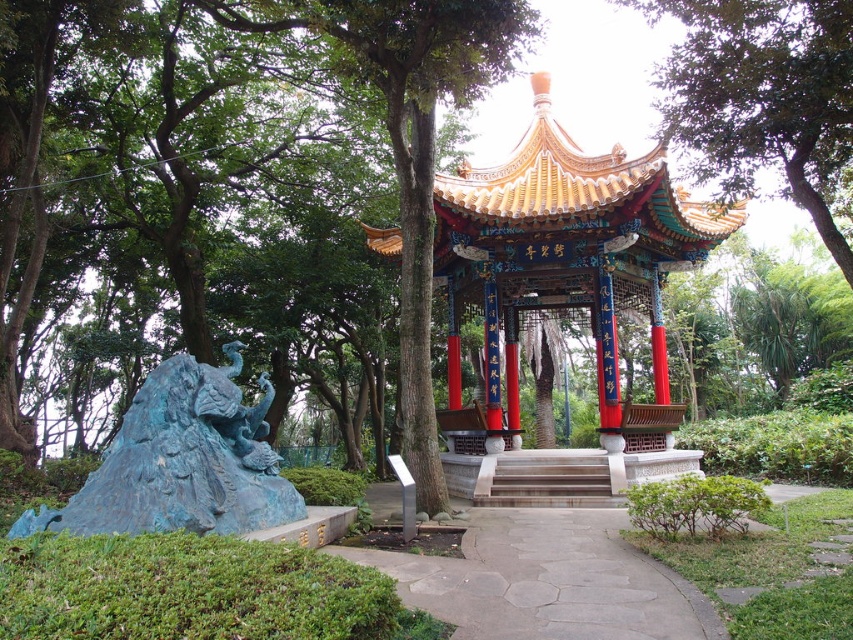
Question: Is gray stone path at center wider than smooth stone stairs at center?

Choices:
 (A) yes
 (B) no

Answer: (A)

Question: Which of the following is the farthest from the observer?

Choices:
 (A) gray stone path at center
 (B) blue patina dragon at lower left
 (C) golden glazed pagoda at center
 (D) smooth stone stairs at center

Answer: (C)

Question: Among these points, which one is farthest from the camera?

Choices:
 (A) (614, 384)
 (B) (490, 556)
 (C) (711, 131)

Answer: (A)

Question: Does golden glazed pagoda at center come behind smooth stone stairs at center?

Choices:
 (A) no
 (B) yes

Answer: (B)

Question: Observing the image, what is the correct spatial positioning of golden glazed pagoda at center in reference to gray stone path at center?

Choices:
 (A) below
 (B) above

Answer: (B)

Question: Among these objects, which one is nearest to the camera?

Choices:
 (A) smooth stone stairs at center
 (B) golden glazed pagoda at center
 (C) blue patina dragon at lower left

Answer: (C)